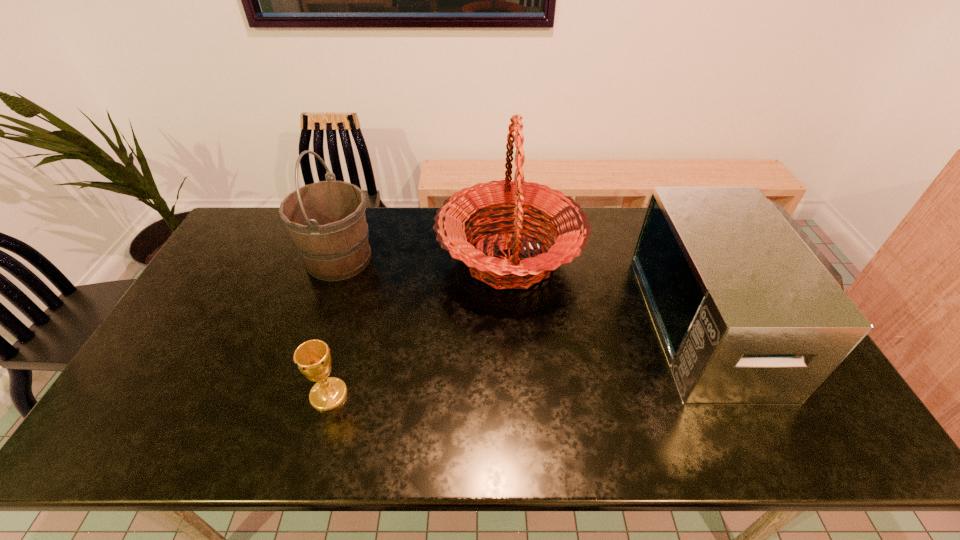
Locate an element on the screen. The image size is (960, 540). the tallest object is located at coordinates (567, 222).

Locate an element on the screen. the third object from left to right is located at coordinates (567, 222).

Image resolution: width=960 pixels, height=540 pixels. In order to click on the third shortest object in this screenshot , I will do `click(326, 220)`.

Where is `the rightmost object`? The height and width of the screenshot is (540, 960). the rightmost object is located at coordinates (748, 310).

I want to click on the second shortest object, so click(x=748, y=310).

Image resolution: width=960 pixels, height=540 pixels. I want to click on the shortest object, so click(313, 359).

Locate an element on the screen. vacant space located on the front of the basket is located at coordinates (516, 354).

The image size is (960, 540). I want to click on vacant space situated on the front of the second tallest object, so click(312, 336).

Locate an element on the screen. vacant space located 0.120m on the front-facing side of the rightmost object is located at coordinates (612, 322).

You are a GUI agent. You are given a task and a screenshot of the screen. Output one action in this format:
    pyautogui.click(x=<x>, y=<y>)
    Task: Click on the vacant region located 0.300m on the front-facing side of the rightmost object
    
    Given the screenshot: What is the action you would take?
    pyautogui.click(x=549, y=322)